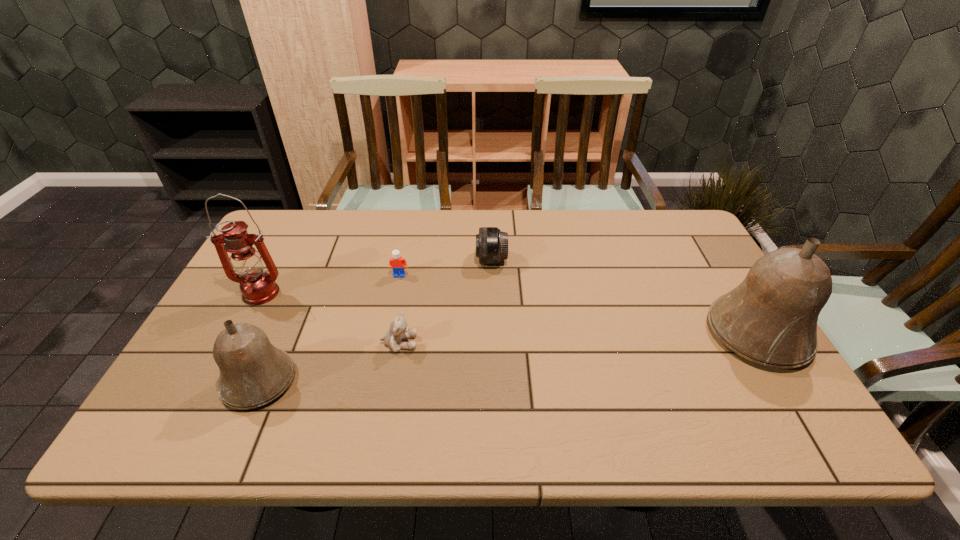
Where is `vacant space located on the back of the taller bell`? This screenshot has width=960, height=540. vacant space located on the back of the taller bell is located at coordinates (715, 265).

The width and height of the screenshot is (960, 540). What are the coordinates of `vacant space situated 0.290m on the front-facing side of the farthest object` in the screenshot? It's located at (382, 260).

The width and height of the screenshot is (960, 540). What are the coordinates of `vacant space located on the front-facing side of the farthest object` in the screenshot? It's located at (385, 260).

Find the location of a particular element. vacant region located on the front-facing side of the farthest object is located at coordinates (401, 260).

The width and height of the screenshot is (960, 540). I want to click on free space located 0.110m on the face of the fifth nearest object, so (394, 305).

Find the location of a particular element. The image size is (960, 540). free space located 0.330m on the face of the teddy bear is located at coordinates (548, 343).

The width and height of the screenshot is (960, 540). Find the location of `vacant area located 0.240m on the front of the oil lamp`. vacant area located 0.240m on the front of the oil lamp is located at coordinates (215, 379).

The width and height of the screenshot is (960, 540). I want to click on object located in the far edge section of the desktop, so coord(491,243).

Locate an element on the screen. This screenshot has height=540, width=960. bell located at the left edge is located at coordinates (253, 372).

Where is `oil lamp located at the left edge`? The image size is (960, 540). oil lamp located at the left edge is located at coordinates (258, 287).